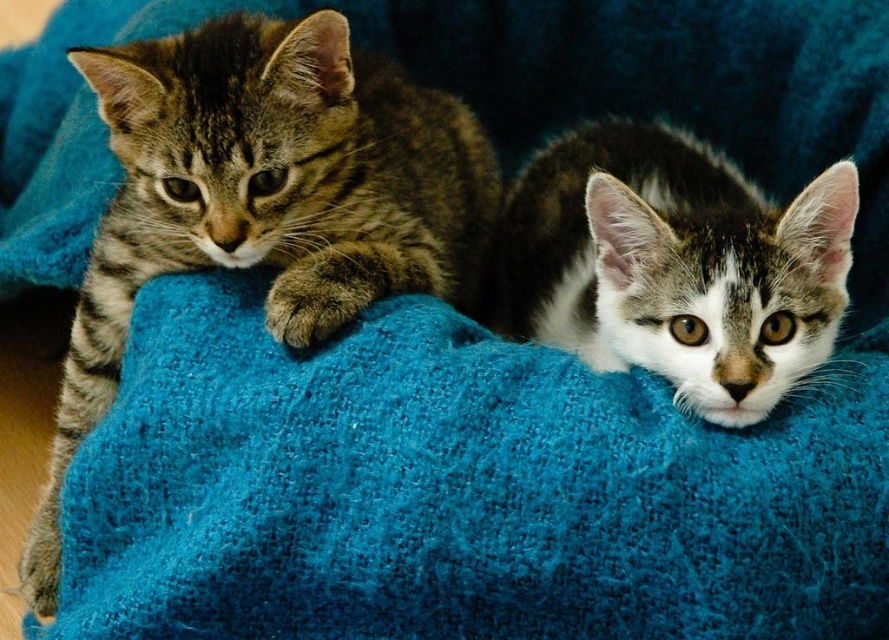
Which is in front, point (870, 380) or point (172, 269)?

Point (870, 380) is in front.

At what (x,y) coordinates should I click in order to perform the action: click on turquoise woolen blanket at center. Please return your answer as a coordinate pair (x, y). Looking at the image, I should click on 457,490.

Does turquoise woolen blanket at center have a greater height compared to tabby fur cat at center?

No.

Is turquoise woolen blanket at center thinner than tabby fur cat at center?

Incorrect, turquoise woolen blanket at center's width is not less than tabby fur cat at center's.

Where is `turquoise woolen blanket at center`? This screenshot has height=640, width=889. turquoise woolen blanket at center is located at coordinates (457, 490).

Identify the location of turquoise woolen blanket at center. The width and height of the screenshot is (889, 640). (457, 490).

Is striped fur cat at left positioned behind tabby fur cat at center?

Yes, striped fur cat at left is further from the viewer.

Who is positioned more to the left, striped fur cat at left or tabby fur cat at center?

Positioned to the left is striped fur cat at left.

Image resolution: width=889 pixels, height=640 pixels. What do you see at coordinates (263, 198) in the screenshot? I see `striped fur cat at left` at bounding box center [263, 198].

Locate an element on the screen. Image resolution: width=889 pixels, height=640 pixels. striped fur cat at left is located at coordinates (263, 198).